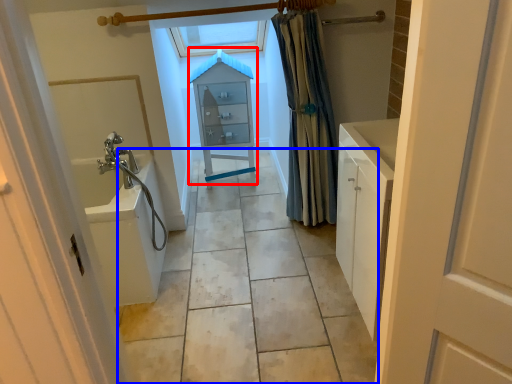
Question: Which object appears closest to the camera in this image, medicine cabinet (highlighted by a red box) or path (highlighted by a blue box)?

Choices:
 (A) medicine cabinet
 (B) path

Answer: (B)